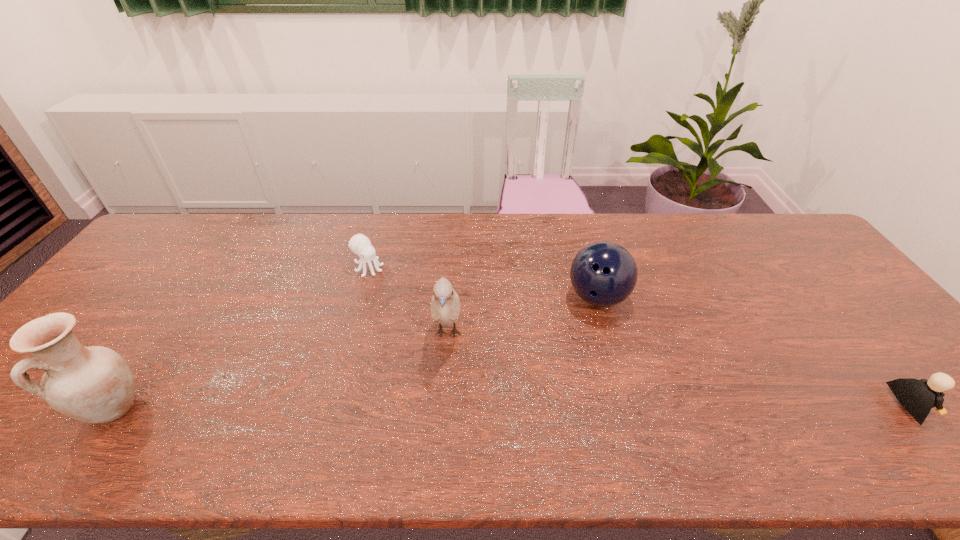
This screenshot has width=960, height=540. I want to click on vacant space on the desktop that is between the pottery and the Lego and is positioned on the surface of the bowling ball near the finger holes, so click(x=600, y=407).

Find the location of a particular element. The width and height of the screenshot is (960, 540). free space on the desktop that is between the leftmost object and the Lego and is positioned at the beak of the third object from left to right is located at coordinates (446, 407).

Identify the location of free space on the desktop that is between the pottery and the rightmost object and is positioned on the front-facing side of the octopus. This screenshot has width=960, height=540. (564, 407).